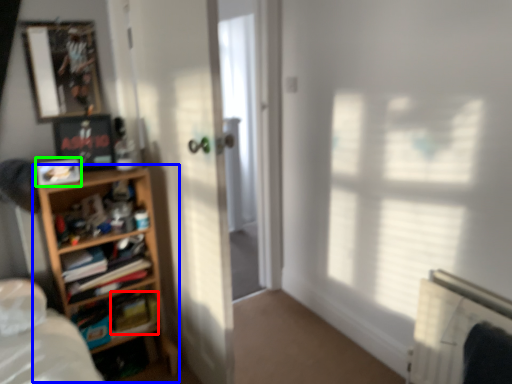
Question: Estimate the real-world distances between objects in this image. Which object is farther from paperback book (highlighted by a red box), shelf (highlighted by a blue box) or picture frame (highlighted by a green box)?

Choices:
 (A) shelf
 (B) picture frame

Answer: (B)